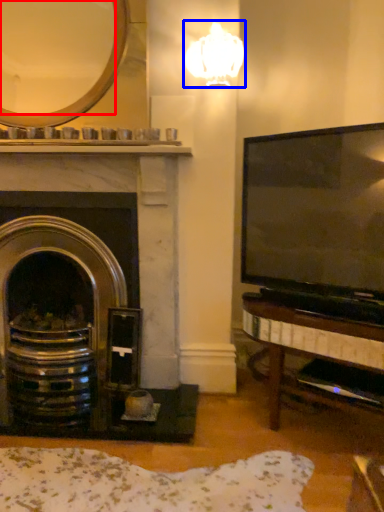
Question: Which object is further to the camera taking this photo, mirror (highlighted by a red box) or lamp (highlighted by a blue box)?

Choices:
 (A) mirror
 (B) lamp

Answer: (A)